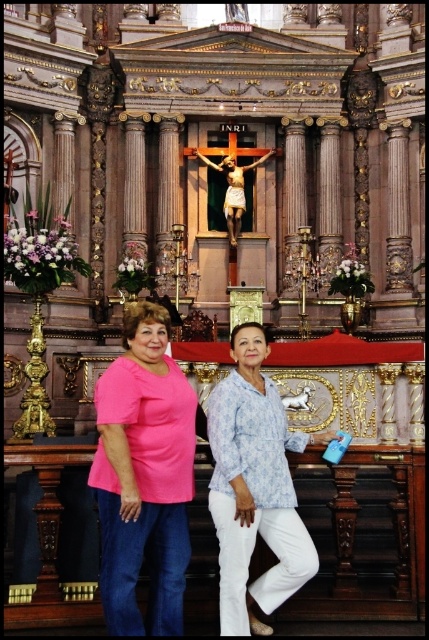
You are a photographer setting up for a group photo in front of the altar. You notice the pink matte shirt at center and the blue printed blouse at center. Which clothing item is positioned lower in the image?

The pink matte shirt at center is below the blue printed blouse at center, so the pink matte shirt at center is positioned lower in the image.

You are a photographer adjusting the lighting in the church. You notice the pink fabric shirt at center and the blue printed blouse at center. Which clothing item is positioned higher in the image?

The pink fabric shirt at center is above the blue printed blouse at center, so it is positioned higher in the image.